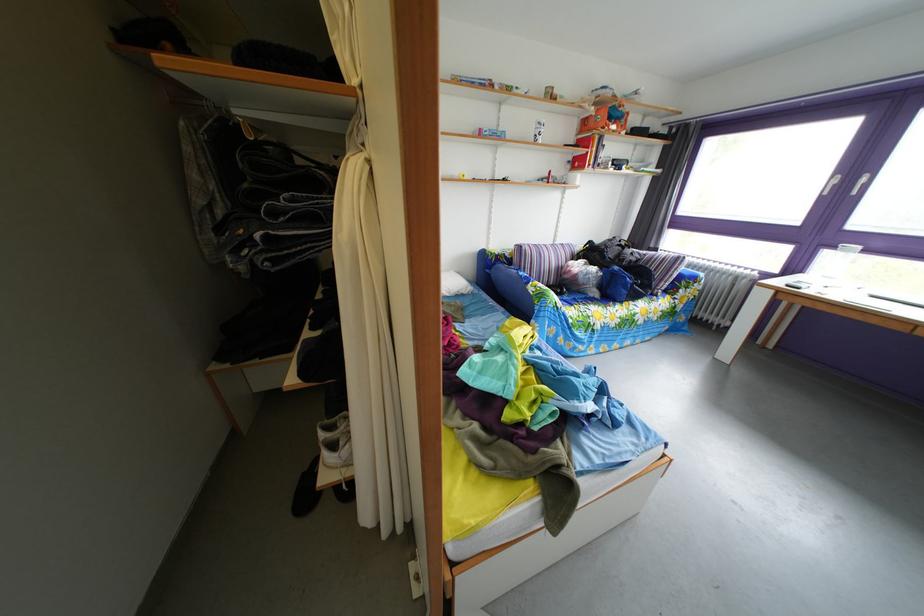
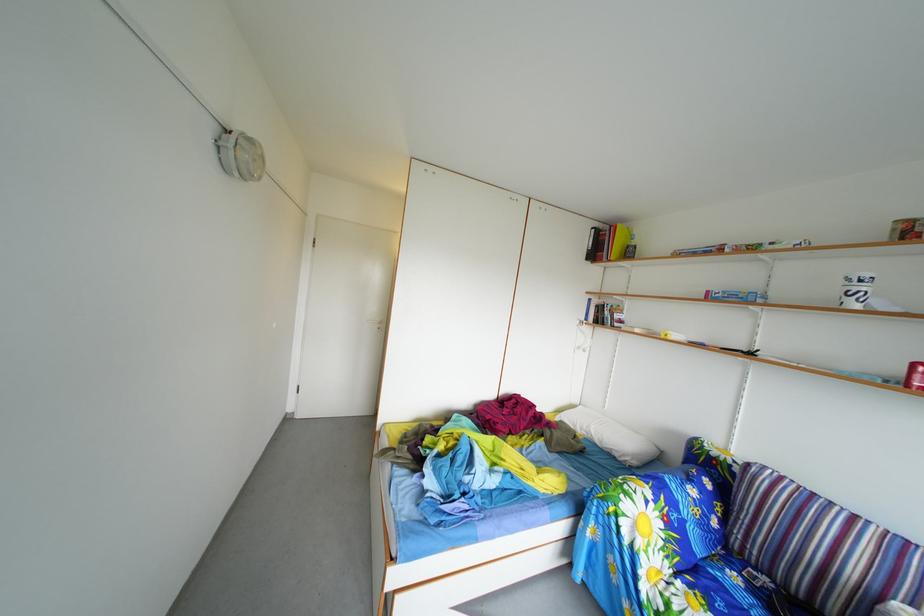
Where in the second image is the point corresponding to the point at 459,301 from the first image?

(612, 451)